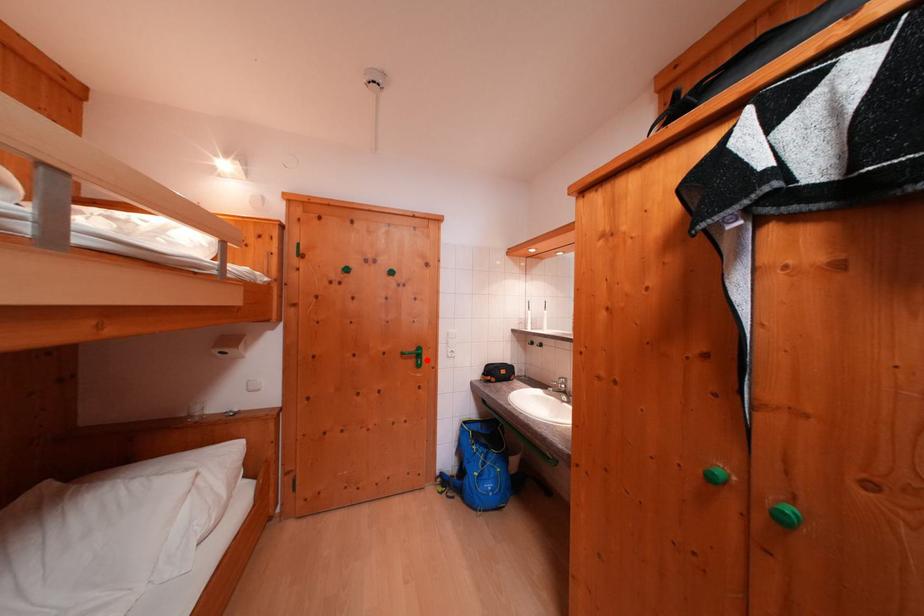
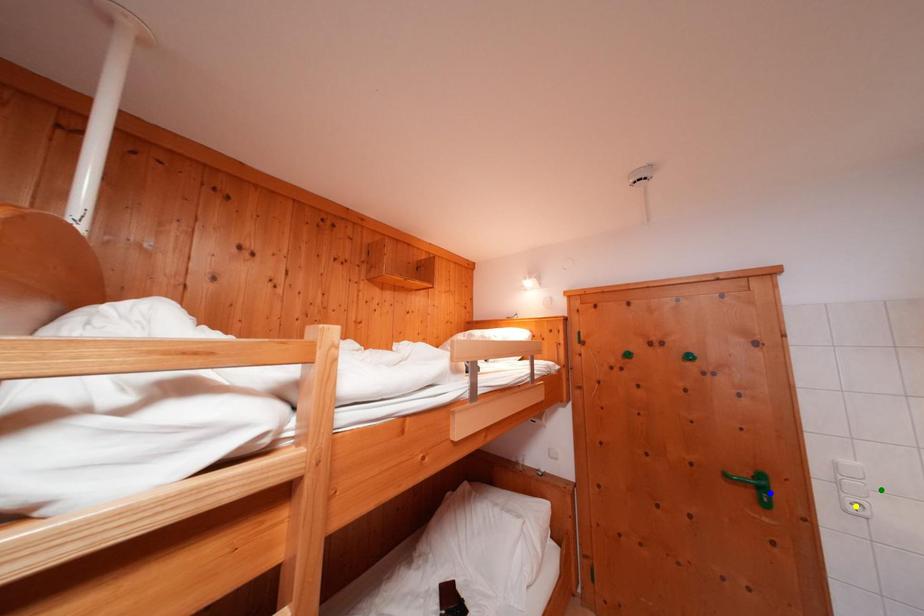
Question: I am providing you with two images of the same scene from different viewpoints. A red point is marked on the first image. You are given multiple points on the second image. Which spot in image 2 lines up with the point in image 1?

Choices:
 (A) yellow point
 (B) blue point
 (C) green point

Answer: (B)